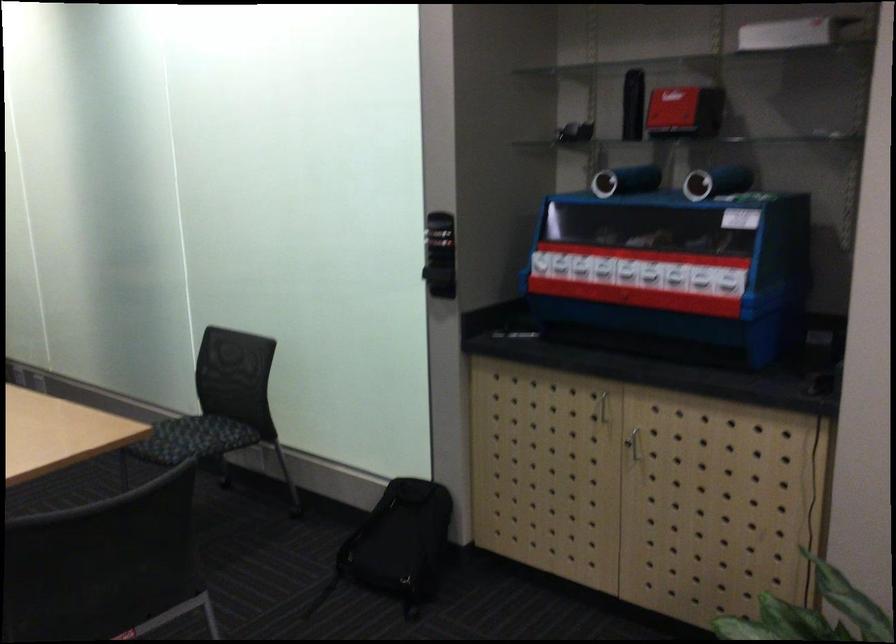
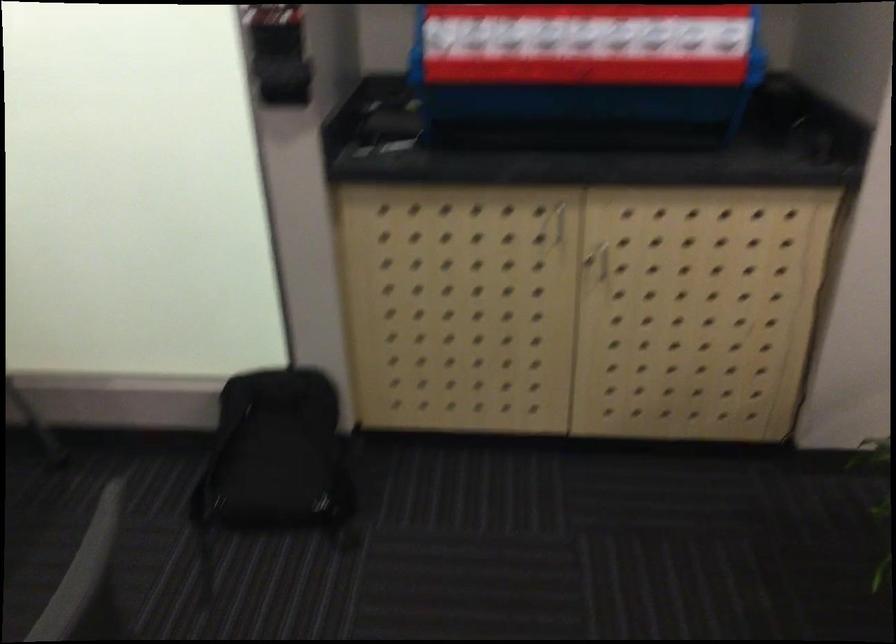
In the second image, find the point that corresponds to [642,444] in the first image.

(604, 261)